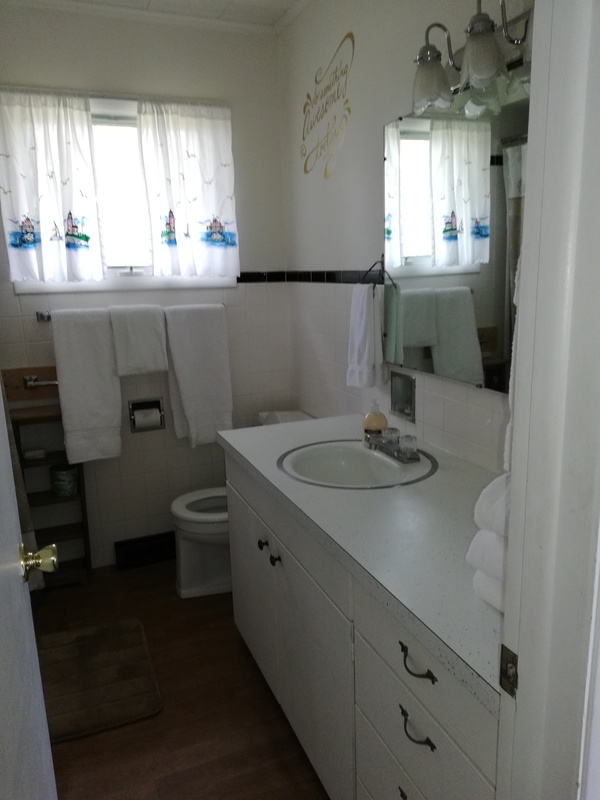
Identify the location of wall painting decoration. The width and height of the screenshot is (600, 800). (314, 106).